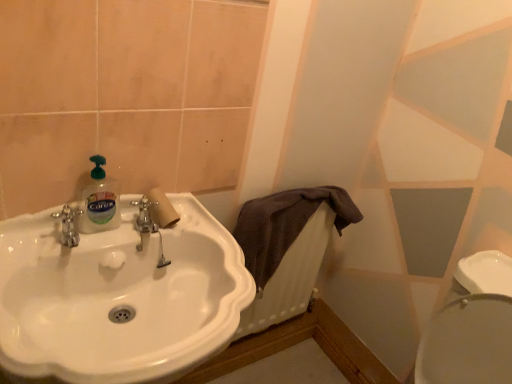
Question: Can you confirm if brown fabric radiator at center is wider than translucent plastic bottle at sink left?

Choices:
 (A) yes
 (B) no

Answer: (B)

Question: Can you confirm if brown fabric radiator at center is positioned to the right of translucent plastic bottle at sink left?

Choices:
 (A) no
 (B) yes

Answer: (B)

Question: Is brown fabric radiator at center closer to the viewer compared to translucent plastic bottle at sink left?

Choices:
 (A) no
 (B) yes

Answer: (A)

Question: Can we say brown fabric radiator at center lies outside translucent plastic bottle at sink left?

Choices:
 (A) no
 (B) yes

Answer: (B)

Question: Is brown fabric radiator at center to the left of translucent plastic bottle at sink left from the viewer's perspective?

Choices:
 (A) no
 (B) yes

Answer: (A)

Question: Considering the positions of brown fabric radiator at center and translucent plastic bottle at sink left in the image, is brown fabric radiator at center taller or shorter than translucent plastic bottle at sink left?

Choices:
 (A) tall
 (B) short

Answer: (A)

Question: Choose the correct answer: Is brown fabric radiator at center inside translucent plastic bottle at sink left or outside it?

Choices:
 (A) inside
 (B) outside

Answer: (B)

Question: From the image's perspective, relative to translucent plastic bottle at sink left, is brown fabric radiator at center above or below?

Choices:
 (A) above
 (B) below

Answer: (B)

Question: Would you say brown fabric radiator at center is to the left or to the right of translucent plastic bottle at sink left in the picture?

Choices:
 (A) right
 (B) left

Answer: (A)

Question: Based on their sizes in the image, would you say translucent plastic bottle at sink left is bigger or smaller than brown fabric radiator at center?

Choices:
 (A) big
 (B) small

Answer: (B)

Question: Do you think translucent plastic bottle at sink left is within brown fabric radiator at center, or outside of it?

Choices:
 (A) inside
 (B) outside

Answer: (B)

Question: In terms of width, does translucent plastic bottle at sink left look wider or thinner when compared to brown fabric radiator at center?

Choices:
 (A) thin
 (B) wide

Answer: (B)

Question: Is translucent plastic bottle at sink left to the left or to the right of brown fabric radiator at center in the image?

Choices:
 (A) left
 (B) right

Answer: (A)

Question: From the image's perspective, is white glossy sink at center above or below purple cotton towel at center?

Choices:
 (A) above
 (B) below

Answer: (B)

Question: From a real-world perspective, is white glossy sink at center physically located above or below purple cotton towel at center?

Choices:
 (A) below
 (B) above

Answer: (A)